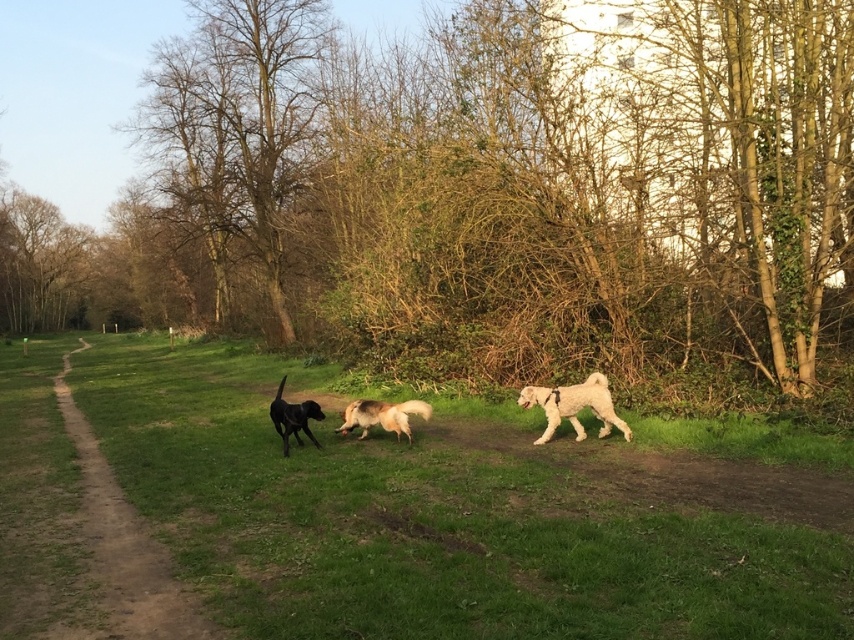
Who is shorter, white fluffy dog at center or shiny black dog at center?

With less height is shiny black dog at center.

Who is more forward, (544, 406) or (279, 429)?

Point (544, 406) is in front.

Does point (581, 384) come behind point (279, 412)?

Yes, point (581, 384) is farther from viewer.

This screenshot has height=640, width=854. Find the location of `white fluffy dog at center`. white fluffy dog at center is located at coordinates (574, 406).

Who is higher up, brown leafless tree at center or fuzzy golden dog at center?

brown leafless tree at center is above.

Is point (287, 164) positioned behind point (377, 406)?

Yes, it is behind point (377, 406).

Where is `brown leafless tree at center`? The width and height of the screenshot is (854, 640). brown leafless tree at center is located at coordinates (484, 195).

Does green grass at center have a lesser width compared to shiny black dog at center?

Incorrect, green grass at center's width is not less than shiny black dog at center's.

Looking at this image, is green grass at center to the right of shiny black dog at center from the viewer's perspective?

In fact, green grass at center is to the left of shiny black dog at center.

Does point (578, 596) lie behind point (303, 416)?

That is False.

Locate an element on the screen. This screenshot has width=854, height=640. green grass at center is located at coordinates (453, 515).